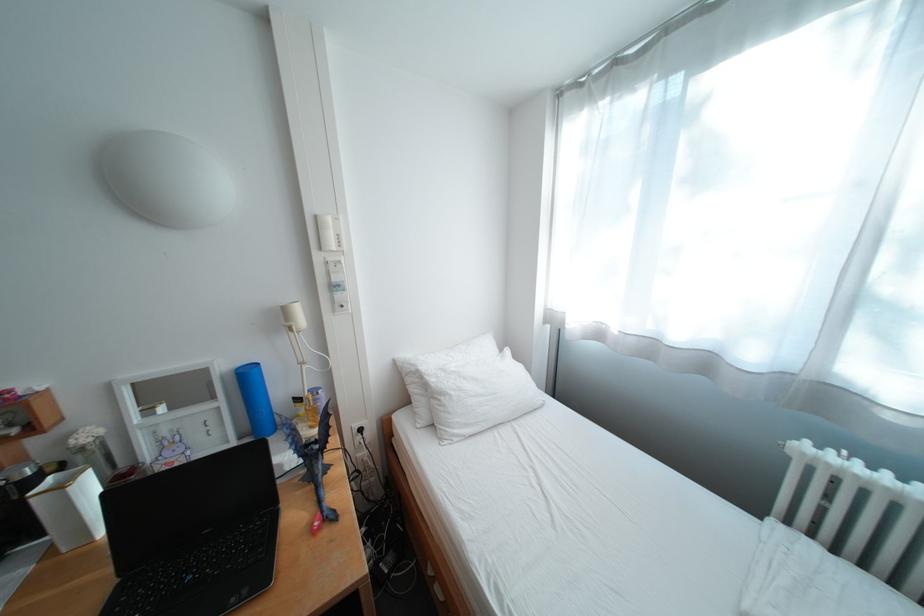
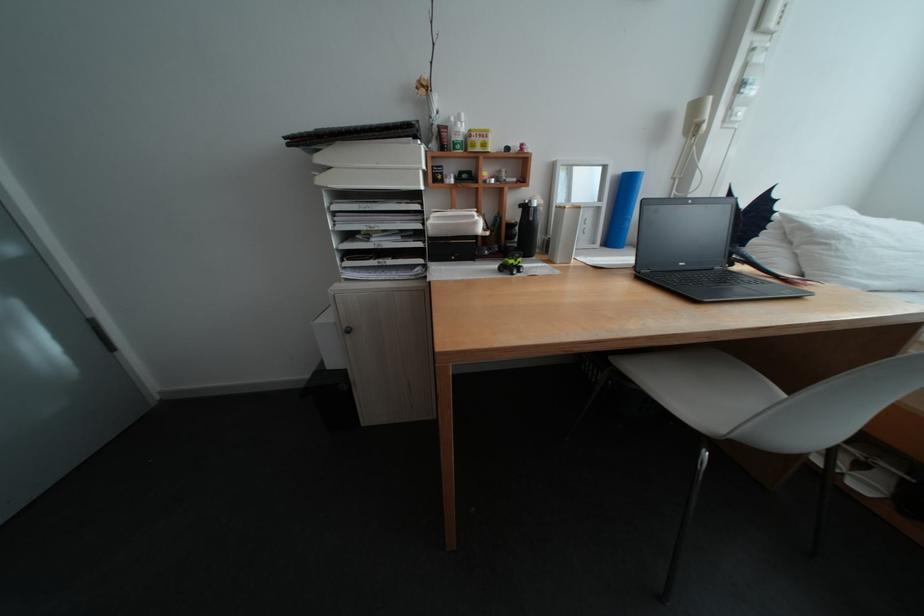
In the second image, find the point that corresponds to (x=234, y=403) in the first image.

(616, 205)